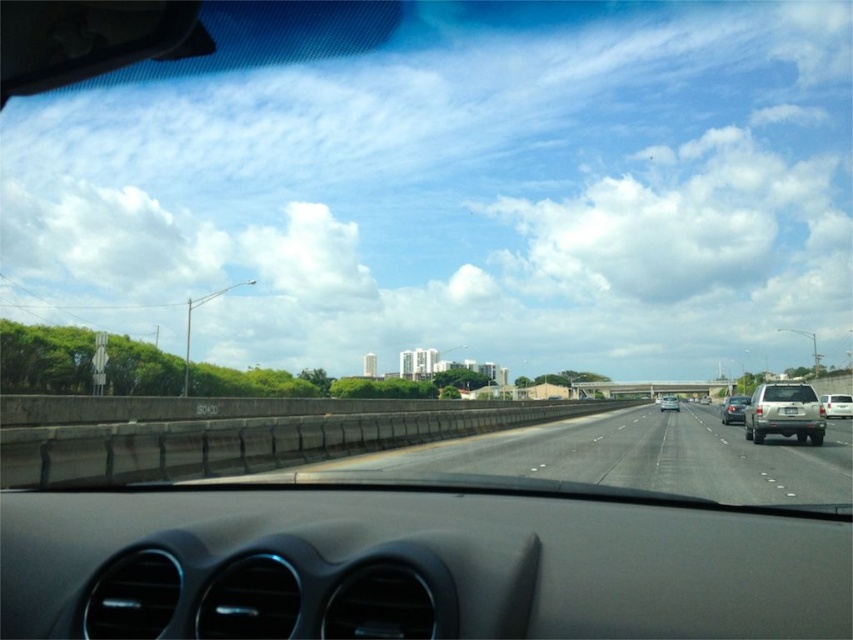
Does satin silver sedan at center have a lesser width compared to silver metallic sedan at center?

Correct, satin silver sedan at center's width is less than silver metallic sedan at center's.

Between point (741, 394) and point (665, 410), which one is positioned behind?

Point (741, 394)

The image size is (853, 640). What are the coordinates of `satin silver sedan at center` in the screenshot? It's located at (733, 410).

Does gray asphalt highway at center lie behind silver metallic suv at right?

That is False.

Locate an element on the screen. This screenshot has width=853, height=640. gray asphalt highway at center is located at coordinates (635, 458).

In the scene shown: Does satin gold suv at right have a greater width compared to silver metallic suv at right?

No.

Does point (779, 403) lie in front of point (844, 403)?

Yes.

Locate an element on the screen. satin gold suv at right is located at coordinates (784, 412).